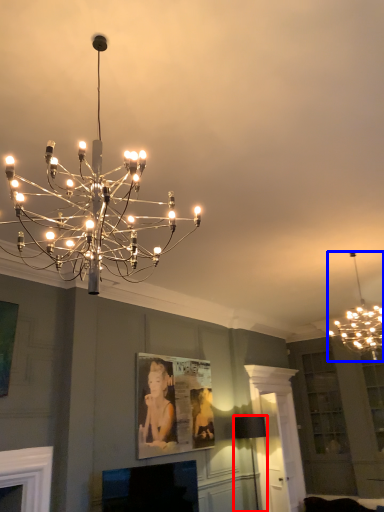
Question: Which of the following is the farthest to the observer, lamp (highlighted by a red box) or lamp (highlighted by a blue box)?

Choices:
 (A) lamp
 (B) lamp

Answer: (A)